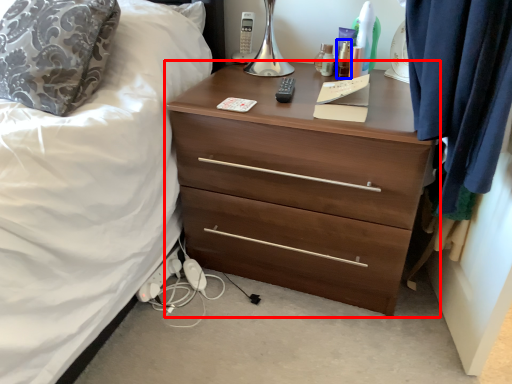
Question: Which object is closer to the camera taking this photo, chest of drawers (highlighted by a red box) or toiletry (highlighted by a blue box)?

Choices:
 (A) chest of drawers
 (B) toiletry

Answer: (A)